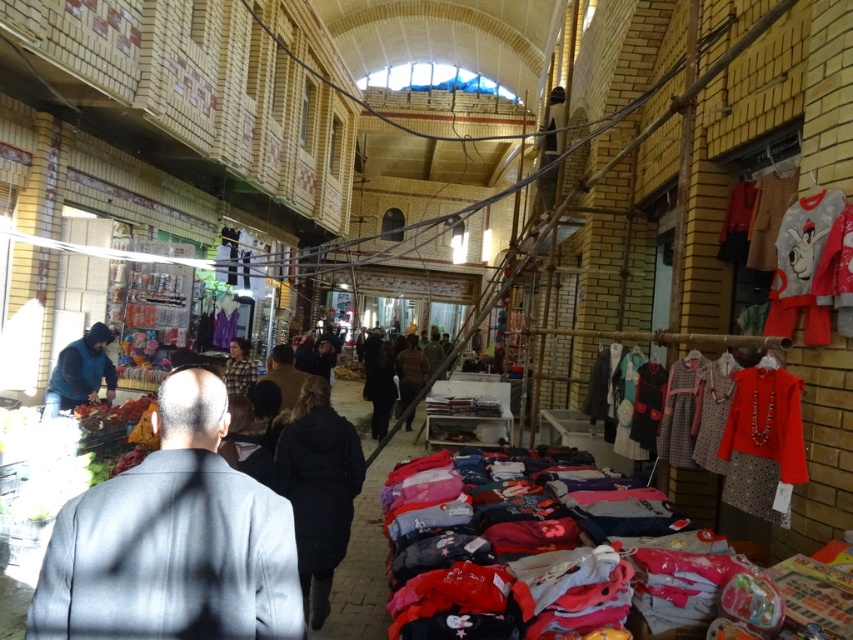
Question: Does dark gray suit at left have a greater width compared to brown fabric at center?

Choices:
 (A) no
 (B) yes

Answer: (A)

Question: Which point is farther from the camera taking this photo?

Choices:
 (A) (236, 321)
 (B) (329, 499)

Answer: (A)

Question: Can you confirm if brown fuzzy coat at center is thinner than purple fabric at center?

Choices:
 (A) yes
 (B) no

Answer: (B)

Question: Which point appears closest to the camera in this image?

Choices:
 (A) (190, 572)
 (B) (329, 547)
 (C) (228, 340)

Answer: (A)

Question: Which point is farther to the camera?

Choices:
 (A) brown fuzzy coat at center
 (B) matte red dress at center
 (C) brown fabric at center
 (D) checkered fabric shirt at center

Answer: (C)

Question: Is multicolored fabric shirts at center closer to the viewer compared to brown fuzzy coat at center?

Choices:
 (A) no
 (B) yes

Answer: (B)